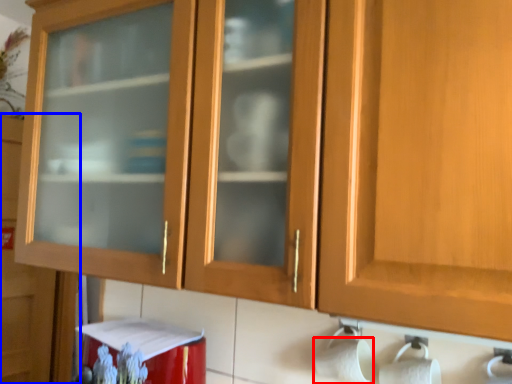
Question: Which of the following is the farthest to the observer, toilet paper (highlighted by a red box) or cupboard (highlighted by a blue box)?

Choices:
 (A) toilet paper
 (B) cupboard

Answer: (B)